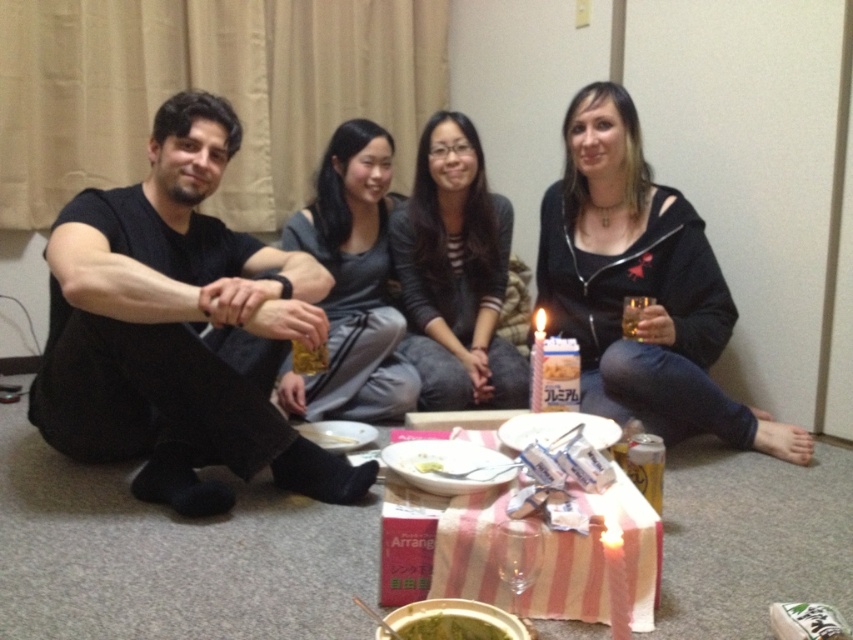
You are organizing a small gathering and need to place a 12 inch wide decorative plate between the black hoodie at center and the translucent glass beverage at lower center. Can the plate fit between them based on their widths?

The black hoodie at center is wider than the translucent glass beverage at lower center. Since the plate is 12 inches wide, it depends on the actual width between them. However, the description only states the hoodie is wider, not the exact distance. Without specific measurements, we cannot confirm if the plate will fit.

Where is the black matte shirt at left located in the image?

The black matte shirt at left is located at point (178, 330).